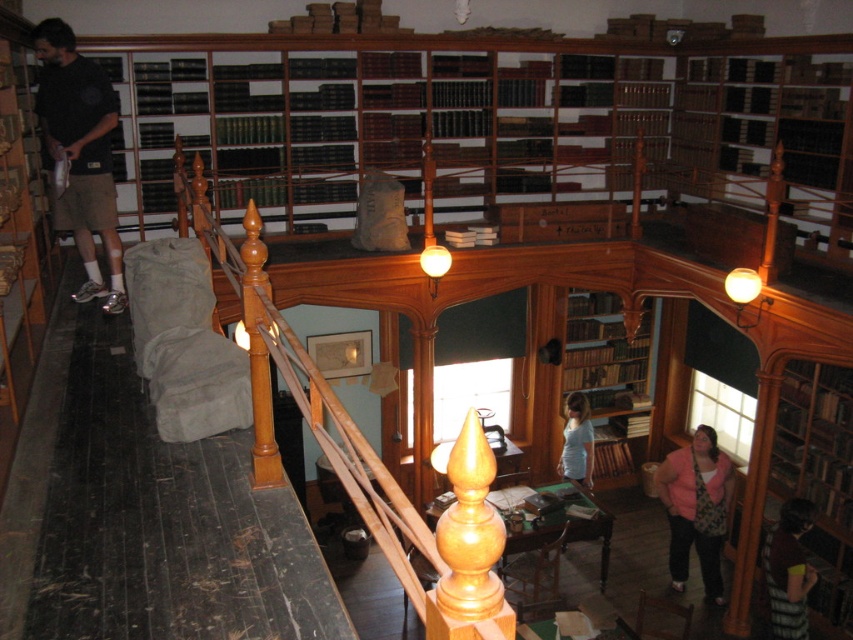
Question: From the image, what is the correct spatial relationship of matte black shirt at left in relation to pink fabric at lower right?

Choices:
 (A) left
 (B) right

Answer: (A)

Question: Where is brown wooden bookshelf at center located in relation to pink fabric at lower right in the image?

Choices:
 (A) above
 (B) below

Answer: (A)

Question: Can you confirm if matte black shirt at left is positioned below striped fabric shirt at lower right?

Choices:
 (A) yes
 (B) no

Answer: (B)

Question: Which object is the farthest from the wooden bookshelf at lower right?

Choices:
 (A) pink fabric at lower right
 (B) brown wooden bookshelf at center
 (C) matte black shirt at left

Answer: (C)

Question: Estimate the real-world distances between objects in this image. Which object is farther from the brown wooden bookshelf at center?

Choices:
 (A) matte black shirt at left
 (B) wooden bookshelf at lower right
 (C) pink fabric at lower right
 (D) white matte shirt at center

Answer: (A)

Question: Which point is farther to the camera?

Choices:
 (A) pos(36,49)
 (B) pos(813,474)
 (C) pos(621,470)

Answer: (C)